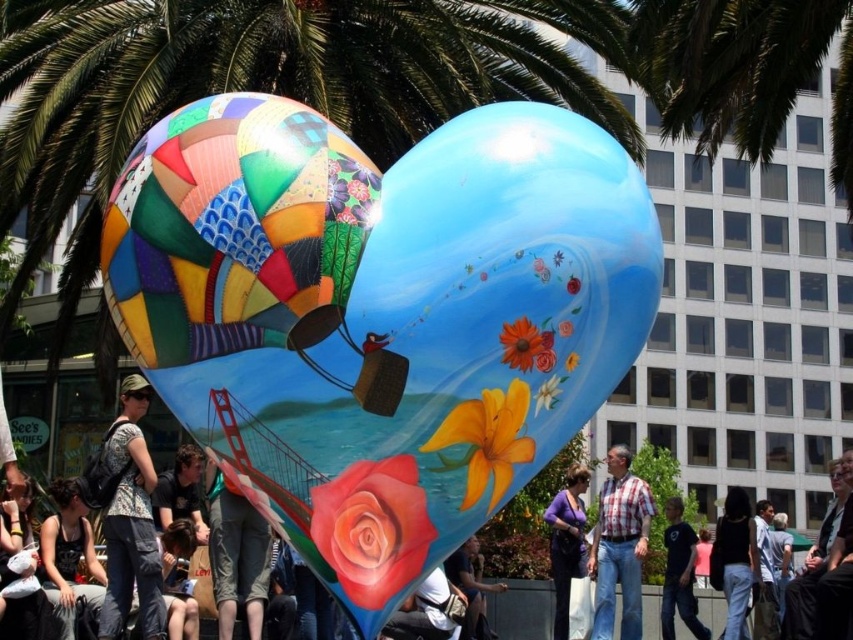
You are a photographer planning to take a photo of the hot air balloon sculpture. You notice a green leafy palm tree at upper left and a plaid shirt at center in the background. Which object should you adjust your camera focus to ensure the larger one is in sharp focus?

The green leafy palm tree at upper left is larger than the plaid shirt at center, so you should focus on the green leafy palm tree at upper left to ensure it is in sharp focus.